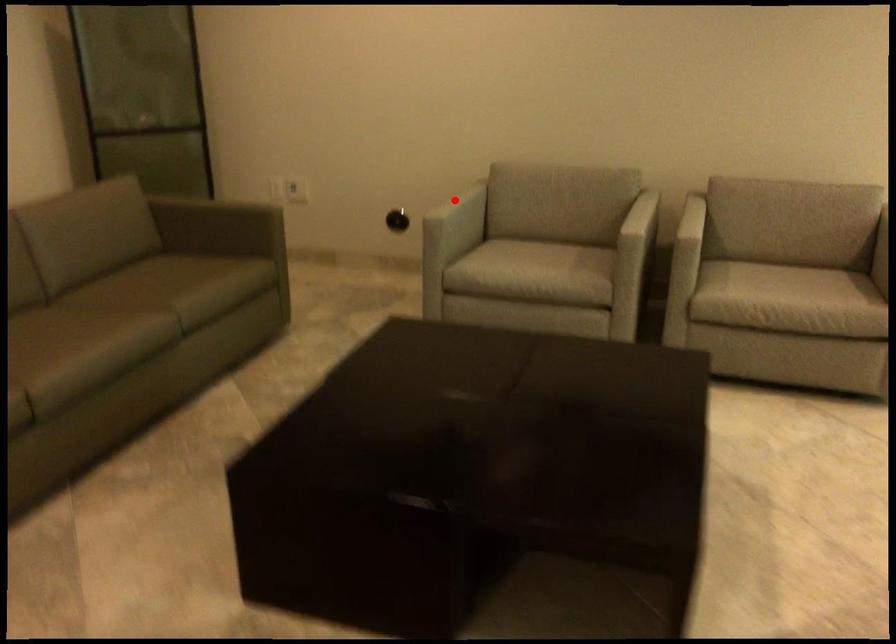
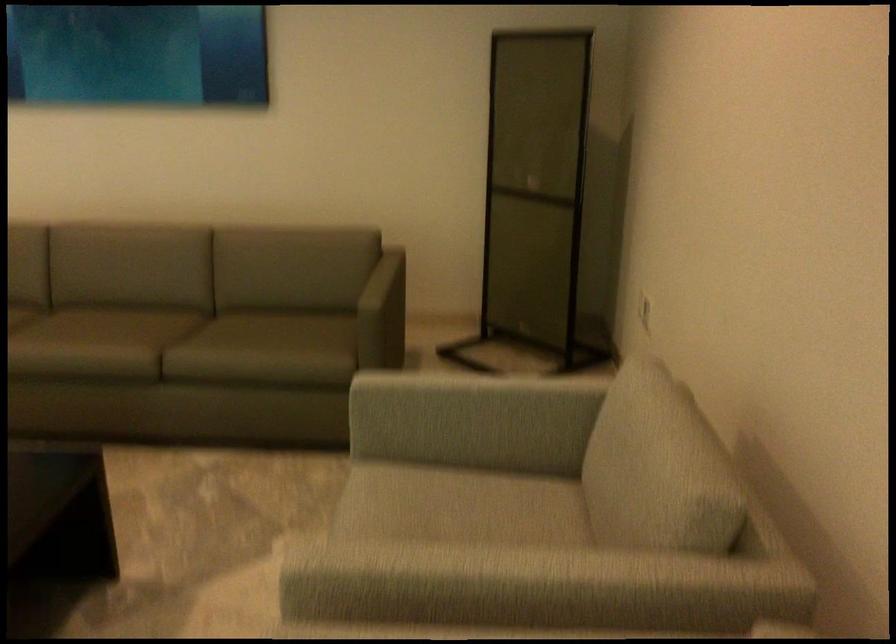
Question: I am providing you with two images of the same scene from different viewpoints. A red point is shown in image1. For the corresponding object point in image2, is it positioned nearer or farther from the camera?

Choices:
 (A) Nearer
 (B) Farther

Answer: (A)